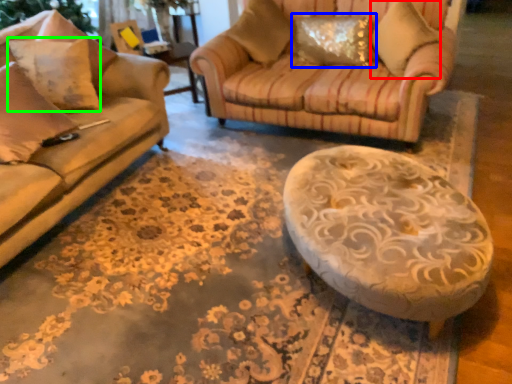
Question: Which is farther away from pillow (highlighted by a red box)? pillow (highlighted by a blue box) or pillow (highlighted by a green box)?

Choices:
 (A) pillow
 (B) pillow

Answer: (B)